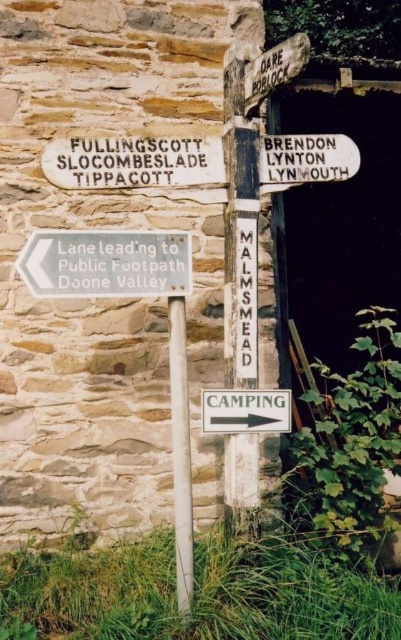
Question: Which object is farther from the camera taking this photo?

Choices:
 (A) white wooden pole at center
 (B) white wooden sign at upper right

Answer: (B)

Question: Is white wooden pole at center positioned at the back of white wooden sign at lower right?

Choices:
 (A) yes
 (B) no

Answer: (B)

Question: Does white wooden pole at center appear on the right side of wooden signpost at upper center?

Choices:
 (A) no
 (B) yes

Answer: (A)

Question: Which point is farther to the camera?

Choices:
 (A) (281, 148)
 (B) (46, 284)

Answer: (A)

Question: Is white wooden pole at center to the left of wooden signpost at upper center from the viewer's perspective?

Choices:
 (A) yes
 (B) no

Answer: (A)

Question: Considering the real-world distances, which object is farthest from the wooden signpost at upper center?

Choices:
 (A) white plastic sign at lower left
 (B) white wooden sign at upper right

Answer: (A)